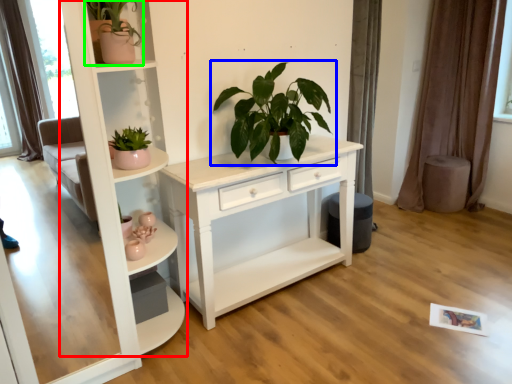
Question: Which is farther away from shelf (highlighted by a red box)? houseplant (highlighted by a blue box) or houseplant (highlighted by a green box)?

Choices:
 (A) houseplant
 (B) houseplant

Answer: (A)